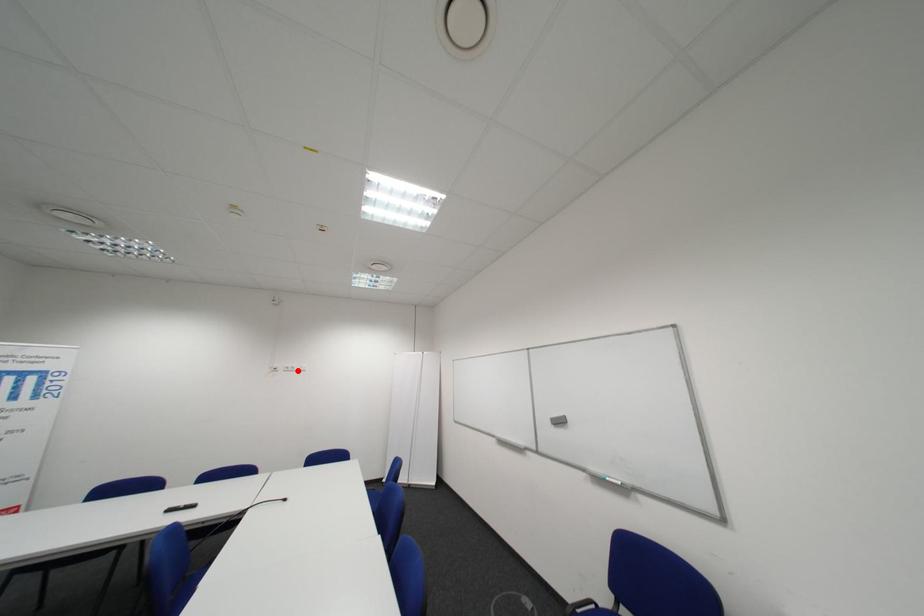
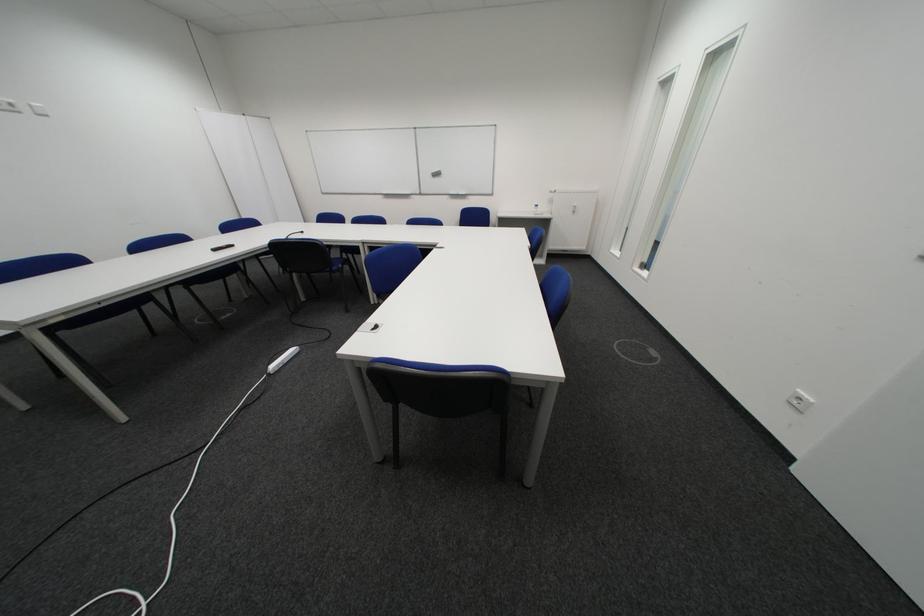
In the second image, find the point that corresponds to the highlighted location in the first image.

(8, 108)